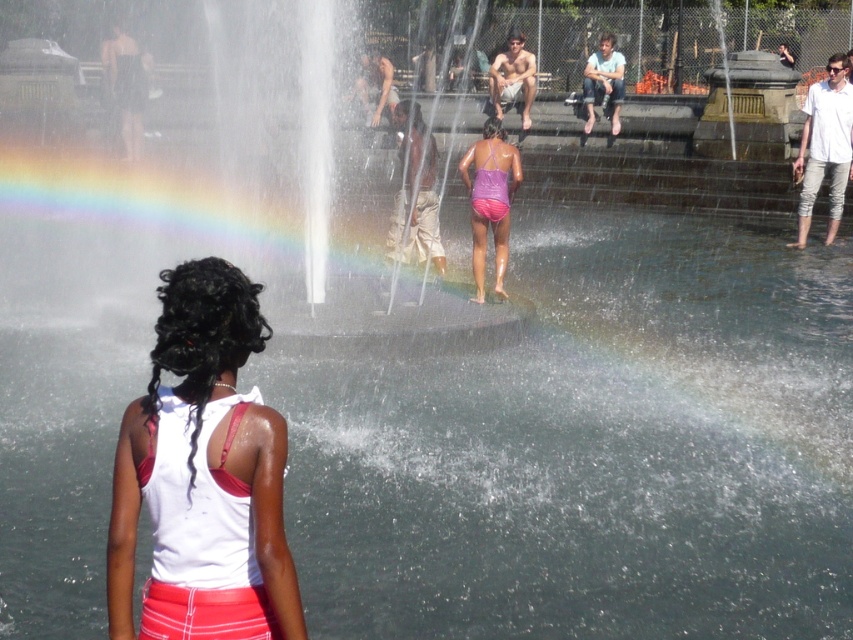
You are organizing a clothing display and need to arrange the white matte tank top at center and the purple matte swimsuit at center side by side. Based on their sizes, which should be placed on the left to accommodate their widths without overlapping?

→ The white matte tank top at center should be placed on the left since it might be wider than the purple matte swimsuit at center, allowing enough space between them.

You are a photographer trying to capture a candid shot of the white matte tank top at center and the purple matte swimsuit at center in the fountain scene. Which clothing item is shorter in height?

The white matte tank top at center has a lesser height compared to the purple matte swimsuit at center, so the white matte tank top at center is shorter in height.

You are a photographer trying to capture the rainbow created by the fountain. You notice the white matte tank top at center and the purple matte swimsuit at center in your frame. Which clothing item is positioned lower in the image?

The white matte tank top at center is located below the purple matte swimsuit at center, so the white matte tank top at center is positioned lower in the image.